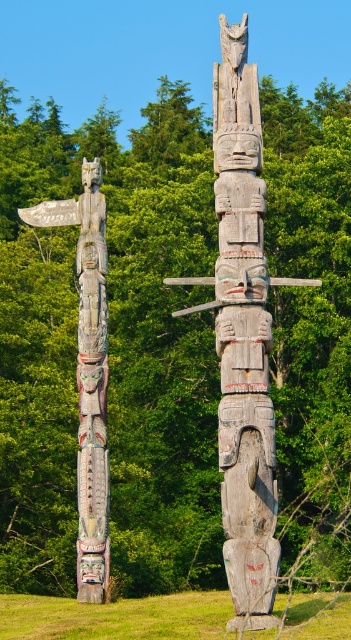
Question: Which point is farther to the camera?

Choices:
 (A) (261, 620)
 (B) (76, 544)

Answer: (B)

Question: Which point is farther to the camera?

Choices:
 (A) weathered wood totem pole at center
 (B) carved wooden totem pole at left

Answer: (B)

Question: Does weathered wood totem pole at center have a smaller size compared to carved wooden totem pole at left?

Choices:
 (A) no
 (B) yes

Answer: (A)

Question: Which point is farther from the camera taking this photo?

Choices:
 (A) (235, 276)
 (B) (21, 211)

Answer: (B)

Question: Is weathered wood totem pole at center to the left of carved wooden totem pole at left from the viewer's perspective?

Choices:
 (A) no
 (B) yes

Answer: (A)

Question: Is the position of weathered wood totem pole at center more distant than that of carved wooden totem pole at left?

Choices:
 (A) no
 (B) yes

Answer: (A)